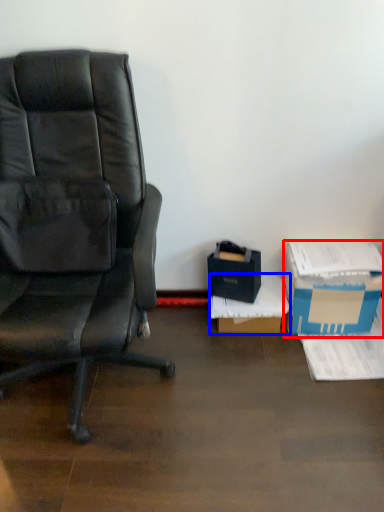
Question: Which of the following is the farthest to the observer, box (highlighted by a red box) or box (highlighted by a blue box)?

Choices:
 (A) box
 (B) box

Answer: (B)